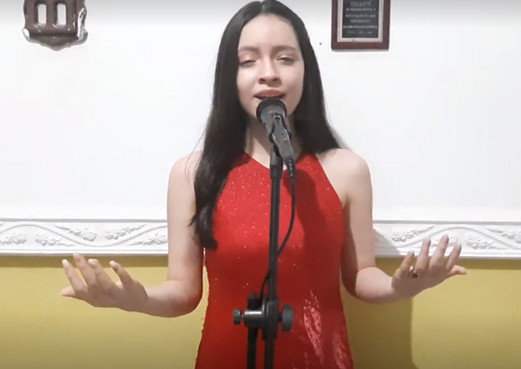
Locate an element on the screen. decorative wainscoting is located at coordinates (47, 235), (127, 238), (485, 235).